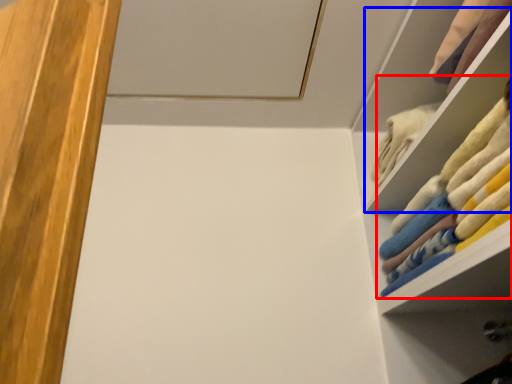
Question: Which of the following is the farthest to the observer, laundry (highlighted by a red box) or cabinet (highlighted by a blue box)?

Choices:
 (A) laundry
 (B) cabinet

Answer: (B)